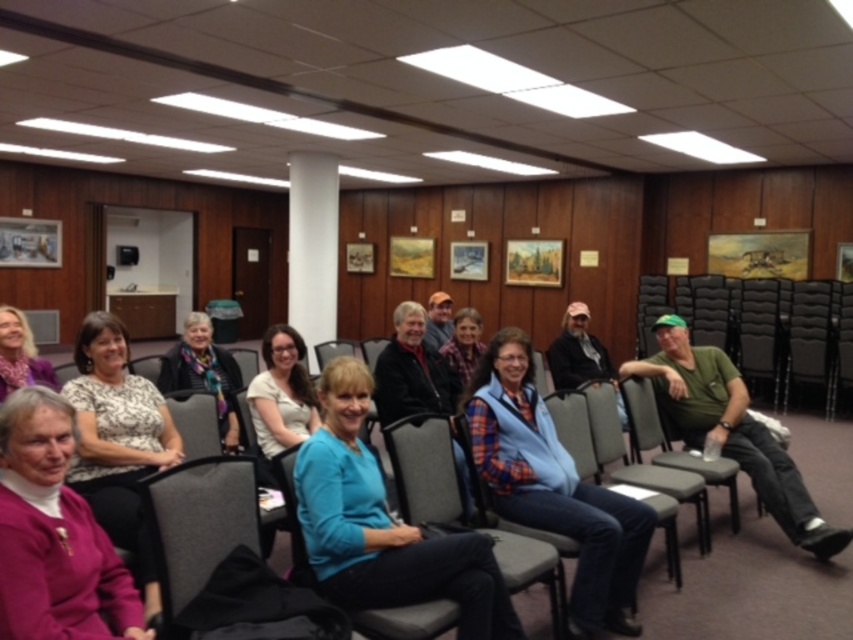
Question: Does gray fabric chair at center have a larger size compared to multicolored scarf at center?

Choices:
 (A) yes
 (B) no

Answer: (B)

Question: Estimate the real-world distances between objects in this image. Which object is closer to the matte blue sweater at center?

Choices:
 (A) gray fabric chair at center
 (B) plaid shirt at center

Answer: (A)

Question: Is blue plaid vest at center bigger than gray fabric chair at center?

Choices:
 (A) yes
 (B) no

Answer: (A)

Question: Which point appears closest to the camera in this image?

Choices:
 (A) (312, 406)
 (B) (515, 362)

Answer: (B)

Question: Which point is farther to the camera?

Choices:
 (A) blue fabric shirt at center
 (B) plaid shirt at center
 (C) purple sweater at lower left

Answer: (B)

Question: Can you confirm if purple sweater at lower left is positioned to the left of patterned fabric blouse at center?

Choices:
 (A) no
 (B) yes

Answer: (A)